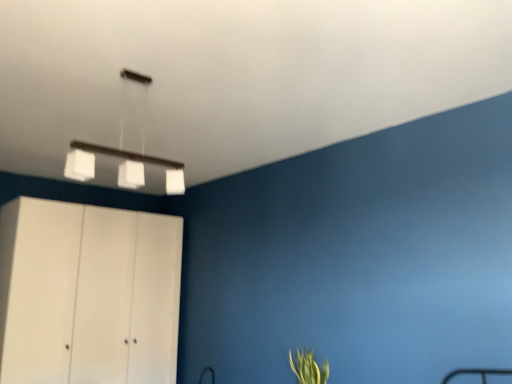
Question: Is white matte cabinet at left touching green leafy plant at lower right?

Choices:
 (A) no
 (B) yes

Answer: (A)

Question: From a real-world perspective, is white matte cabinet at left positioned over green leafy plant at lower right based on gravity?

Choices:
 (A) yes
 (B) no

Answer: (A)

Question: Does white matte cabinet at left appear on the left side of green leafy plant at lower right?

Choices:
 (A) no
 (B) yes

Answer: (B)

Question: Considering the relative sizes of white matte cabinet at left and green leafy plant at lower right in the image provided, is white matte cabinet at left wider than green leafy plant at lower right?

Choices:
 (A) yes
 (B) no

Answer: (A)

Question: Would you say white matte cabinet at left is outside green leafy plant at lower right?

Choices:
 (A) no
 (B) yes

Answer: (B)

Question: Based on their sizes in the image, would you say white matte cabinet at left is bigger or smaller than white matte rectangular light fixture at upper center?

Choices:
 (A) small
 (B) big

Answer: (B)

Question: Is white matte cabinet at left wider or thinner than white matte rectangular light fixture at upper center?

Choices:
 (A) thin
 (B) wide

Answer: (B)

Question: Which is correct: white matte cabinet at left is inside white matte rectangular light fixture at upper center, or outside of it?

Choices:
 (A) outside
 (B) inside

Answer: (A)

Question: In the image, is white matte cabinet at left on the left side or the right side of white matte rectangular light fixture at upper center?

Choices:
 (A) right
 (B) left

Answer: (B)

Question: From the image's perspective, is white matte rectangular light fixture at upper center located above or below white matte cabinet at left?

Choices:
 (A) above
 (B) below

Answer: (A)

Question: From a real-world perspective, is white matte rectangular light fixture at upper center physically located above or below white matte cabinet at left?

Choices:
 (A) below
 (B) above

Answer: (B)

Question: Is white matte rectangular light fixture at upper center wider or thinner than white matte cabinet at left?

Choices:
 (A) wide
 (B) thin

Answer: (B)

Question: In terms of size, does white matte rectangular light fixture at upper center appear bigger or smaller than white matte cabinet at left?

Choices:
 (A) small
 (B) big

Answer: (A)

Question: Visually, is white matte rectangular light fixture at upper center positioned to the left or to the right of green leafy plant at lower right?

Choices:
 (A) left
 (B) right

Answer: (A)

Question: Is point (76, 172) positioned closer to the camera than point (313, 369)?

Choices:
 (A) farther
 (B) closer

Answer: (B)